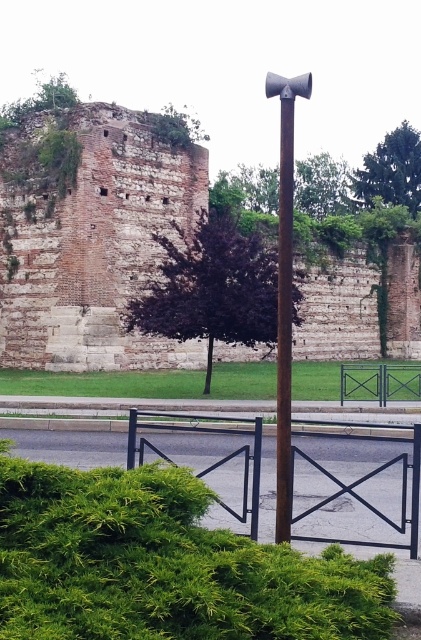
You are standing at the point closest to the ancient stone wall in the image. There are two points marked in the scene, point A at coordinates point A is point (399, 134) and point B at coordinates point B is point (370, 369). Which point is closer to you?

Point B at coordinates point B is point (370, 369) is closer to you because point A at coordinates point A is point (399, 134) is behind point B.

You are a city planner reviewing a historical site. You notice a green leafy bush at upper right and a point marked at coordinates point (x=391, y=170). Which object is located at those coordinates?

The green leafy bush at upper right is located at point (x=391, y=170).

You are a painter setting up an easel to paint the brick wall at left and the green leafy bush at upper right. You want to ensure your painting accurately represents their sizes. Which object should you draw wider in your painting?

The brick wall at left should be drawn wider in the painting because its width surpasses that of the green leafy bush at upper right.